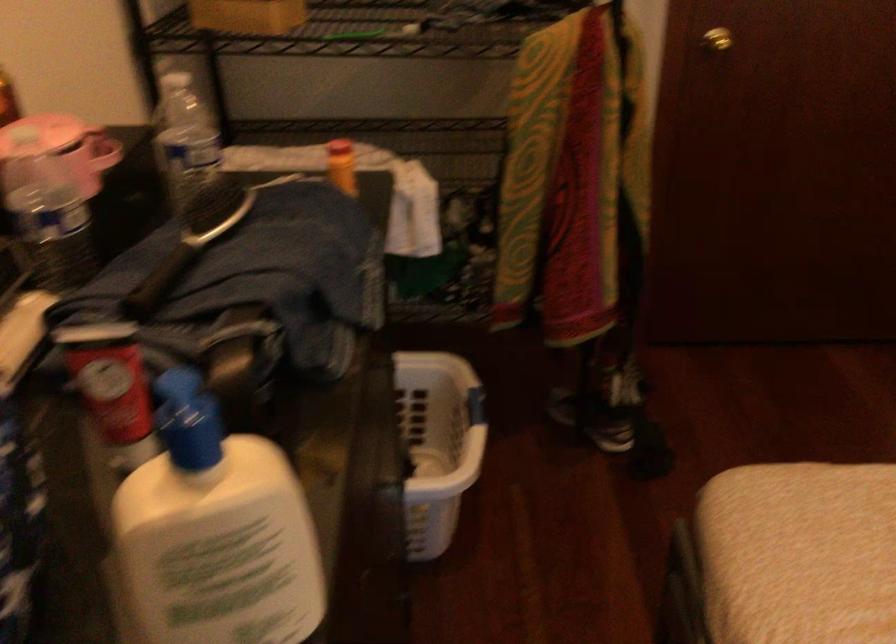
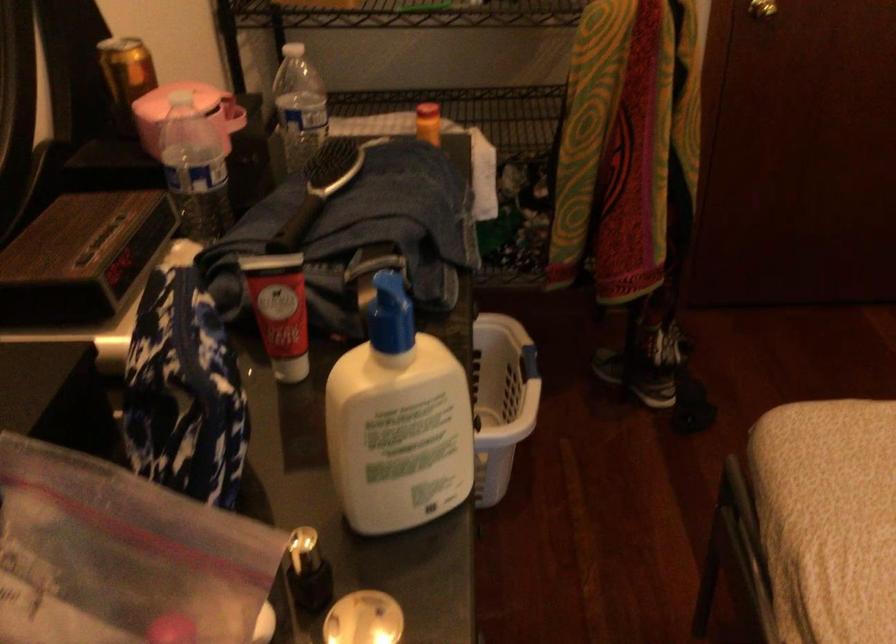
In the second image, find the point that corresponds to (186,140) in the first image.

(298, 106)